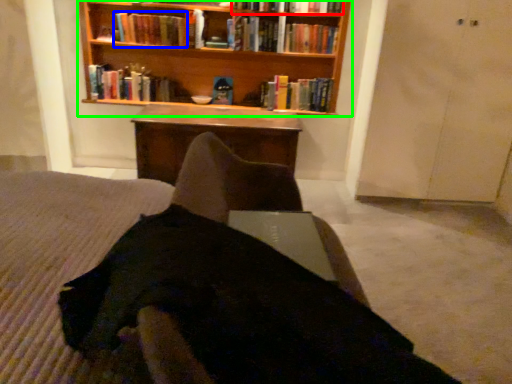
Question: Which object is the closest to the book (highlighted by a red box)? Choose among these: book (highlighted by a blue box) or bookcase (highlighted by a green box).

Choices:
 (A) book
 (B) bookcase

Answer: (B)